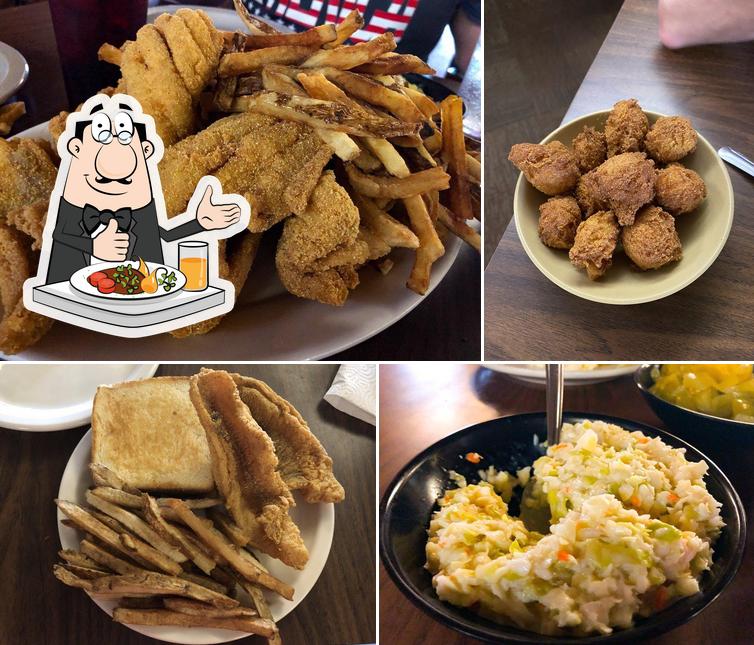
The width and height of the screenshot is (754, 645). In order to click on place to hold utensil in this screenshot , I will do `click(746, 163)`, `click(556, 398)`.